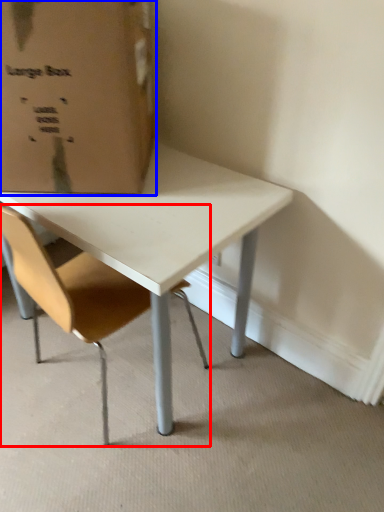
Question: Which point is closer to the camera, chair (highlighted by a red box) or cardboard box (highlighted by a blue box)?

Choices:
 (A) chair
 (B) cardboard box

Answer: (A)